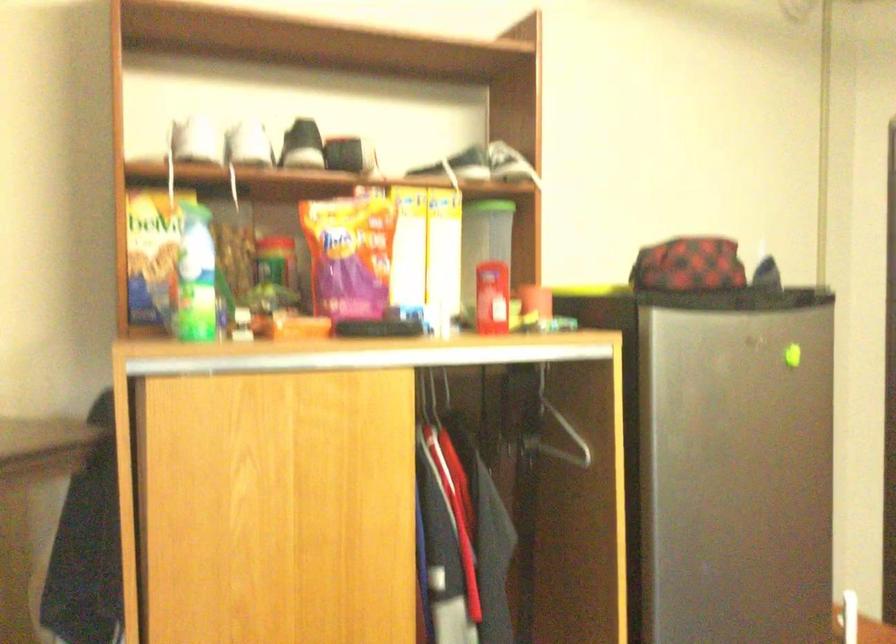
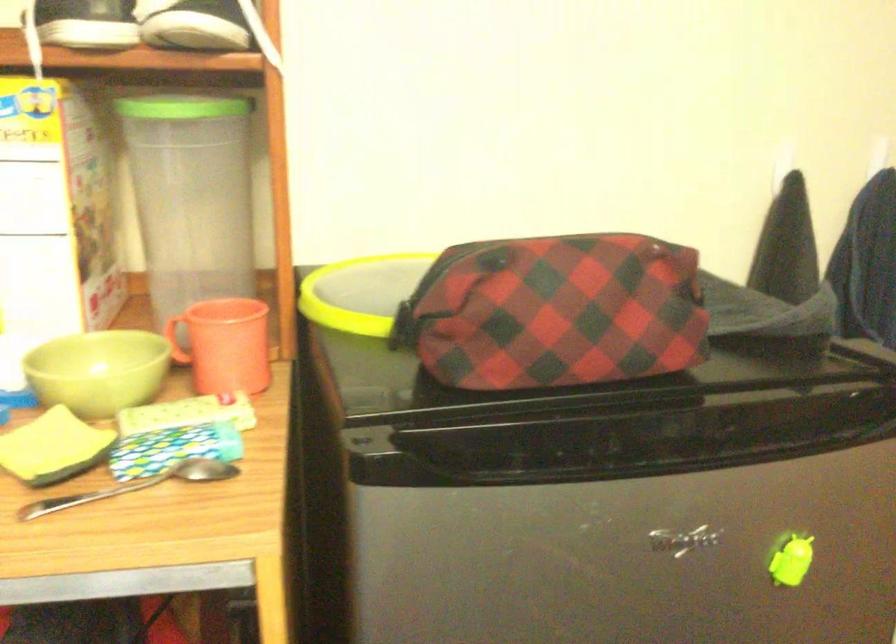
In the second image, find the point that corresponds to pixel 475 319 in the first image.

(98, 371)